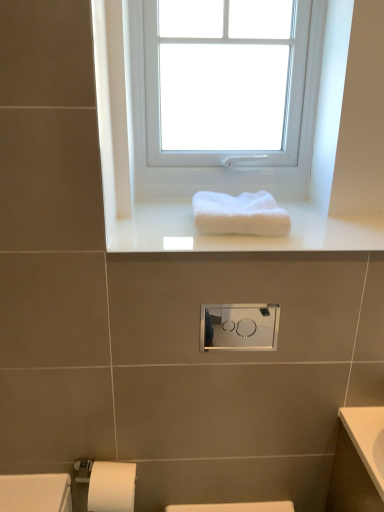
What do you see at coordinates (243, 234) in the screenshot? This screenshot has width=384, height=512. I see `white glossy towel at upper center` at bounding box center [243, 234].

Where is `white plastic window at upper center`? The width and height of the screenshot is (384, 512). white plastic window at upper center is located at coordinates (224, 95).

What do you see at coordinates (241, 327) in the screenshot? I see `satin silver medicine cabinet at center` at bounding box center [241, 327].

Describe the element at coordinates (239, 214) in the screenshot. The height and width of the screenshot is (512, 384). I see `white fluffy towel at center` at that location.

The width and height of the screenshot is (384, 512). What are the coordinates of `white glossy towel at upper center` in the screenshot? It's located at (243, 234).

Which object is thinner, satin silver medicine cabinet at center or white fluffy towel at center?

With smaller width is satin silver medicine cabinet at center.

Can you tell me how much satin silver medicine cabinet at center and white fluffy towel at center differ in facing direction?

The facing directions of satin silver medicine cabinet at center and white fluffy towel at center are 0.503 degrees apart.

Is satin silver medicine cabinet at center touching white fluffy towel at center?

No, satin silver medicine cabinet at center is not next to white fluffy towel at center.

Considering the sizes of satin silver medicine cabinet at center and white plastic window at upper center in the image, is satin silver medicine cabinet at center wider or thinner than white plastic window at upper center?

Clearly, satin silver medicine cabinet at center has less width compared to white plastic window at upper center.

Considering the positions of points (252, 346) and (246, 22), is point (252, 346) closer to camera compared to point (246, 22)?

Yes, it is in front of point (246, 22).

In the image, is satin silver medicine cabinet at center positioned in front of or behind white plastic window at upper center?

In the image, satin silver medicine cabinet at center appears in front of white plastic window at upper center.

Based on the photo, can you confirm if satin silver medicine cabinet at center is taller than white plastic window at upper center?

No, satin silver medicine cabinet at center is not taller than white plastic window at upper center.

Between white glossy towel at upper center and white plastic window at upper center, which one has less height?

white glossy towel at upper center.

Between white glossy towel at upper center and white plastic window at upper center, which one has larger width?

Wider between the two is white glossy towel at upper center.

Does white glossy towel at upper center lie in front of white plastic window at upper center?

That is True.

Can you confirm if white glossy towel at upper center is bigger than white plastic window at upper center?

Actually, white glossy towel at upper center might be smaller than white plastic window at upper center.

From a real-world perspective, which is physically above, white fluffy towel at center or satin silver medicine cabinet at center?

white fluffy towel at center is physically above.

This screenshot has width=384, height=512. I want to click on towel above the satin silver medicine cabinet at center (from a real-world perspective), so click(x=239, y=214).

Considering the points (260, 194) and (246, 328), which point is in front, point (260, 194) or point (246, 328)?

The point (260, 194) is closer.

Looking at this image, from a real-world perspective, is white fluffy towel at center physically below white glossy towel at upper center?

Incorrect, from a real-world perspective, white fluffy towel at center is higher than white glossy towel at upper center.

Locate an element on the screen. window sill that appears below the white fluffy towel at center (from a real-world perspective) is located at coordinates point(243,234).

Looking at this image, from the image's perspective, does white fluffy towel at center appear higher than white glossy towel at upper center?

Yes, from the image's perspective, white fluffy towel at center is above white glossy towel at upper center.

Is white fluffy towel at center oriented towards white glossy towel at upper center?

No, white fluffy towel at center is not aimed at white glossy towel at upper center.

Can we say white plastic window at upper center lies outside satin silver medicine cabinet at center?

Yes.

Can you see white plastic window at upper center touching satin silver medicine cabinet at center?

No, white plastic window at upper center is not making contact with satin silver medicine cabinet at center.

From the image's perspective, is white plastic window at upper center below satin silver medicine cabinet at center?

Actually, white plastic window at upper center appears above satin silver medicine cabinet at center in the image.

In terms of height, does white plastic window at upper center look taller or shorter compared to satin silver medicine cabinet at center?

white plastic window at upper center is taller than satin silver medicine cabinet at center.

How distant is white glossy towel at upper center from satin silver medicine cabinet at center?

white glossy towel at upper center is 9.60 inches away from satin silver medicine cabinet at center.

I want to click on window sill on the right of satin silver medicine cabinet at center, so click(243, 234).

Is white glossy towel at upper center aimed at satin silver medicine cabinet at center?

No, white glossy towel at upper center does not turn towards satin silver medicine cabinet at center.

Looking at their sizes, would you say white glossy towel at upper center is wider or thinner than satin silver medicine cabinet at center?

In the image, white glossy towel at upper center appears to be wider than satin silver medicine cabinet at center.

Where is `towel above the satin silver medicine cabinet at center (from the image's perspective)`? towel above the satin silver medicine cabinet at center (from the image's perspective) is located at coordinates (239, 214).

You are a GUI agent. You are given a task and a screenshot of the screen. Output one action in this format:
    pyautogui.click(x=<x>, y=<y>)
    Task: Click on the medicine cabinet in front of the white plastic window at upper center
    The width and height of the screenshot is (384, 512).
    Given the screenshot: What is the action you would take?
    pyautogui.click(x=241, y=327)

When comparing their distances from white glossy towel at upper center, does white plastic window at upper center or white fluffy towel at center seem further?

white plastic window at upper center is positioned further to the anchor white glossy towel at upper center.

When comparing their distances from white fluffy towel at center, does white glossy towel at upper center or white plastic window at upper center seem closer?

Among the two, white glossy towel at upper center is located nearer to white fluffy towel at center.

Based on their spatial positions, is white glossy towel at upper center or satin silver medicine cabinet at center closer to white plastic window at upper center?

white glossy towel at upper center.

Looking at the image, which one is located closer to white glossy towel at upper center, satin silver medicine cabinet at center or white fluffy towel at center?

Based on the image, white fluffy towel at center appears to be nearer to white glossy towel at upper center.

When comparing their distances from white fluffy towel at center, does satin silver medicine cabinet at center or white glossy towel at upper center seem further?

satin silver medicine cabinet at center lies further to white fluffy towel at center than the other object.

Estimate the real-world distances between objects in this image. Which object is closer to white glossy towel at upper center, white plastic window at upper center or satin silver medicine cabinet at center?

satin silver medicine cabinet at center lies closer to white glossy towel at upper center than the other object.

Estimate the real-world distances between objects in this image. Which object is further from white glossy towel at upper center, white fluffy towel at center or satin silver medicine cabinet at center?

satin silver medicine cabinet at center is further to white glossy towel at upper center.

When comparing their distances from satin silver medicine cabinet at center, does white fluffy towel at center or white plastic window at upper center seem further?

white plastic window at upper center.

The width and height of the screenshot is (384, 512). Identify the location of window sill between white fluffy towel at center and satin silver medicine cabinet at center in the up-down direction. (243, 234).

Identify the location of towel that lies between white plastic window at upper center and satin silver medicine cabinet at center from top to bottom. The height and width of the screenshot is (512, 384). (239, 214).

Where is `towel between white plastic window at upper center and white glossy towel at upper center vertically`? This screenshot has width=384, height=512. towel between white plastic window at upper center and white glossy towel at upper center vertically is located at coordinates (239, 214).

The width and height of the screenshot is (384, 512). In order to click on window sill that lies between white plastic window at upper center and satin silver medicine cabinet at center from top to bottom in this screenshot , I will do `click(243, 234)`.